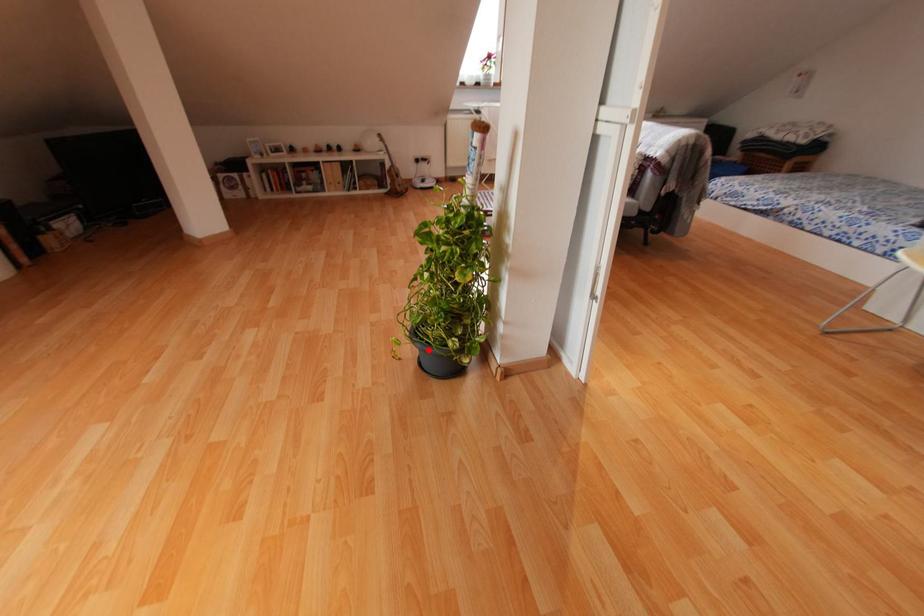
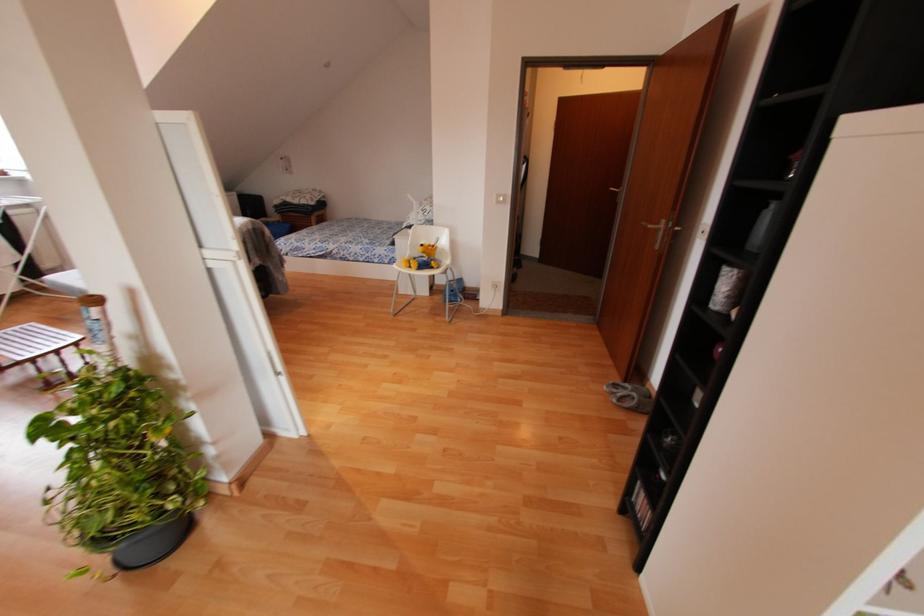
Question: I am providing you with two images of the same scene from different viewpoints. Given a red point in image1, look at the same physical point in image2. Is it:

Choices:
 (A) Closer to the viewpoint
 (B) Farther from the viewpoint

Answer: (A)